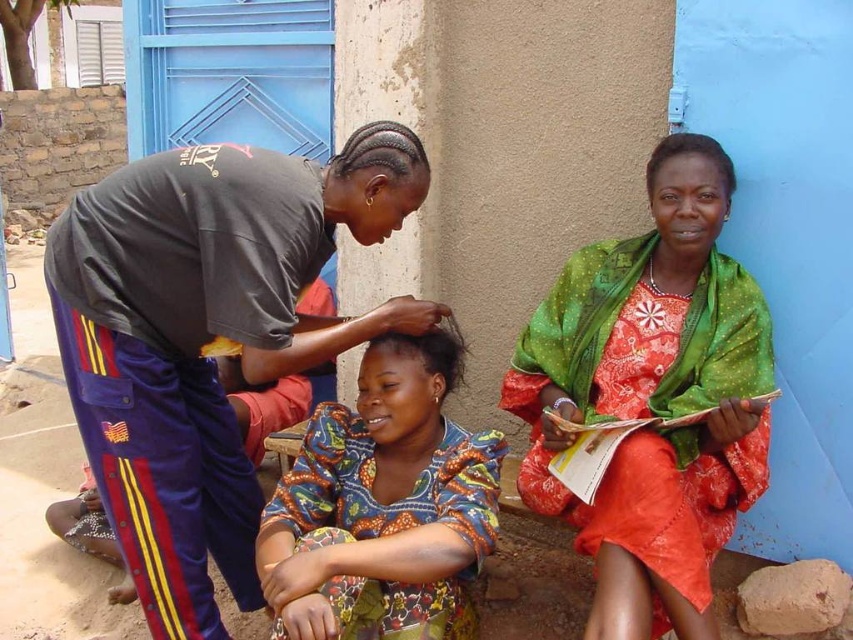
Is green textured scarf at right thinner than printed fabric dress at center?

No.

Find the location of `green textured scarf at right`. green textured scarf at right is located at coordinates (653, 397).

This screenshot has width=853, height=640. In order to click on green textured scarf at right in this screenshot , I will do `click(653, 397)`.

Does matte gray shirt at left appear over printed fabric dress at center?

Indeed, matte gray shirt at left is positioned over printed fabric dress at center.

Which is behind, point (212, 216) or point (459, 536)?

The point (459, 536) is more distant.

Is point (165, 518) closer to camera compared to point (469, 556)?

No, (165, 518) is further to viewer.

The height and width of the screenshot is (640, 853). What are the coordinates of `matte gray shirt at left` in the screenshot? It's located at (207, 337).

Is matte gray shirt at left thinner than green textured scarf at right?

Incorrect, matte gray shirt at left's width is not less than green textured scarf at right's.

Is the position of matte gray shirt at left more distant than that of green textured scarf at right?

No, it is in front of green textured scarf at right.

Which is behind, point (49, 244) or point (714, 352)?

Point (714, 352)

The height and width of the screenshot is (640, 853). What are the coordinates of `matte gray shirt at left` in the screenshot? It's located at 207,337.